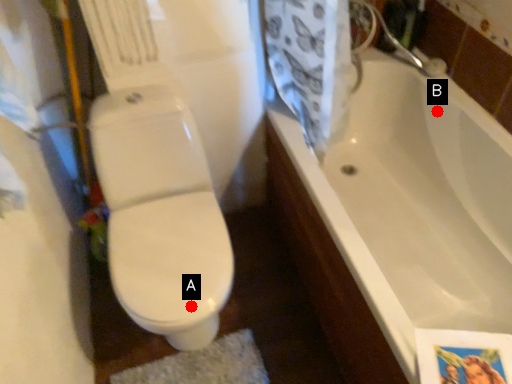
Question: Two points are circled on the image, labeled by A and B beside each circle. Which of the following is the closest to the observer?

Choices:
 (A) A is closer
 (B) B is closer

Answer: (A)